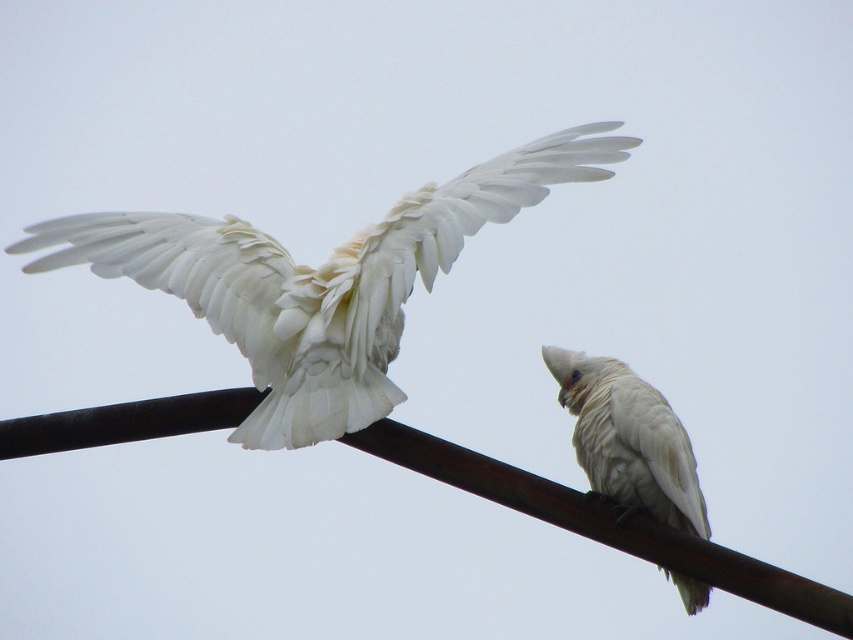
Looking at this image, you are a birdwatcher trying to identify the species of the birds in the image. You notice the rusty metal pole at upper center and the white feathered parrot at center. Which object is wider?

The rusty metal pole at upper center is wider than the white feathered parrot at center.

You are standing in front of the image and want to touch the two points. Which point should you reach for first, point (96, 266) or point (200, 420)?

You should reach for point (96, 266) first because it is closer to you than point (200, 420).